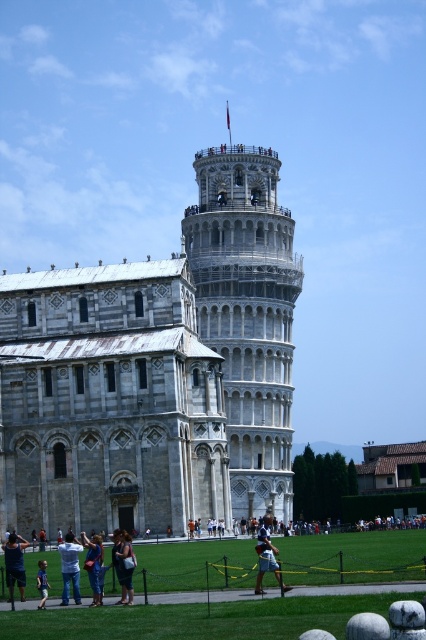
Question: Does dark brown leather jacket at lower center lie in front of blue denim jeans at lower left?

Choices:
 (A) yes
 (B) no

Answer: (A)

Question: Estimate the real-world distances between objects in this image. Which object is closer to the light blue denim jeans at lower center?

Choices:
 (A) blue jeans at lower center
 (B) gray stone tower at center
 (C) dark brown leather jacket at lower center

Answer: (C)

Question: Can you confirm if dark brown leather jacket at lower center is smaller than blue denim jeans at lower left?

Choices:
 (A) yes
 (B) no

Answer: (A)

Question: Among these objects, which one is nearest to the camera?

Choices:
 (A) blue jeans at lower center
 (B) denim jacket at lower left
 (C) blue denim jeans at lower left
 (D) gray stone tower at center

Answer: (B)

Question: Is light blue denim jeans at lower center thinner than blue denim jeans at lower left?

Choices:
 (A) yes
 (B) no

Answer: (A)

Question: Which point is closer to the camera taking this photo?

Choices:
 (A) (275, 548)
 (B) (46, 589)

Answer: (B)